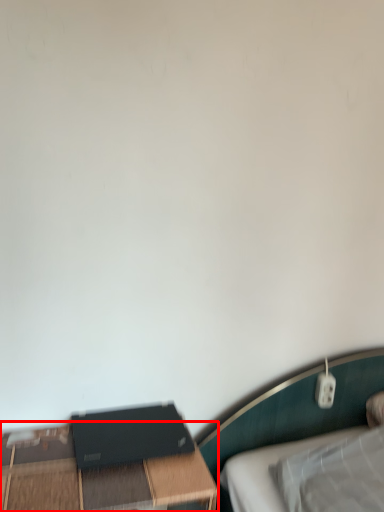
Question: From the image's perspective, where is table (annotated by the red box) located relative to computer?

Choices:
 (A) above
 (B) below

Answer: (B)